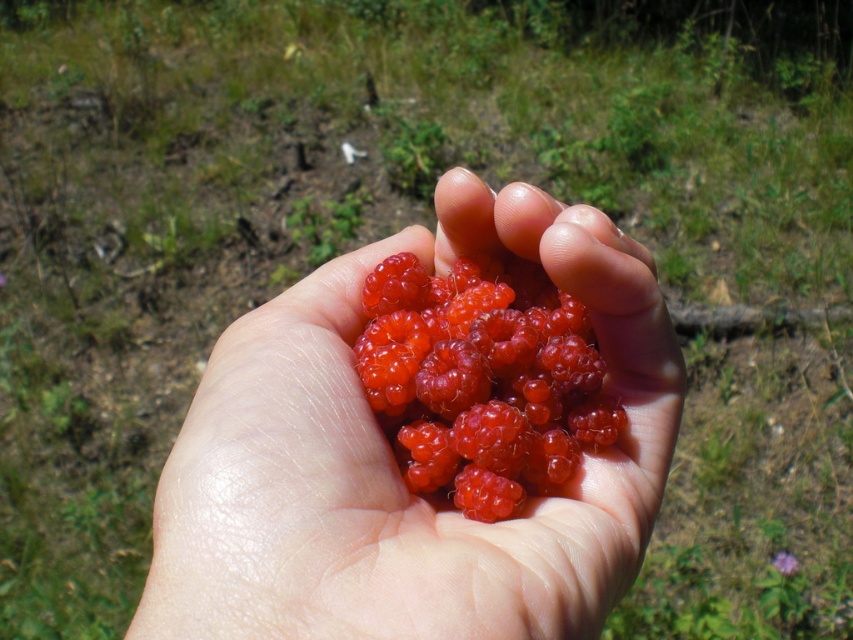
You are a nutritionist analyzing the image of berries in a hand. You need to determine which of the two types of berries, the glossy red raspberries at center or the shiny red berries at center, is larger in size. Which one is bigger?

The glossy red raspberries at center is bigger than the shiny red berries at center according to the description.